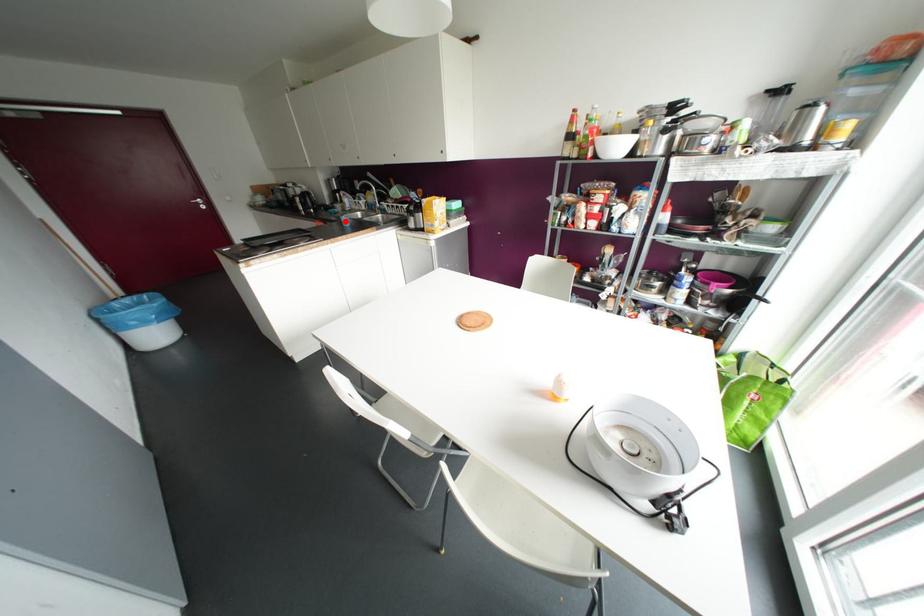
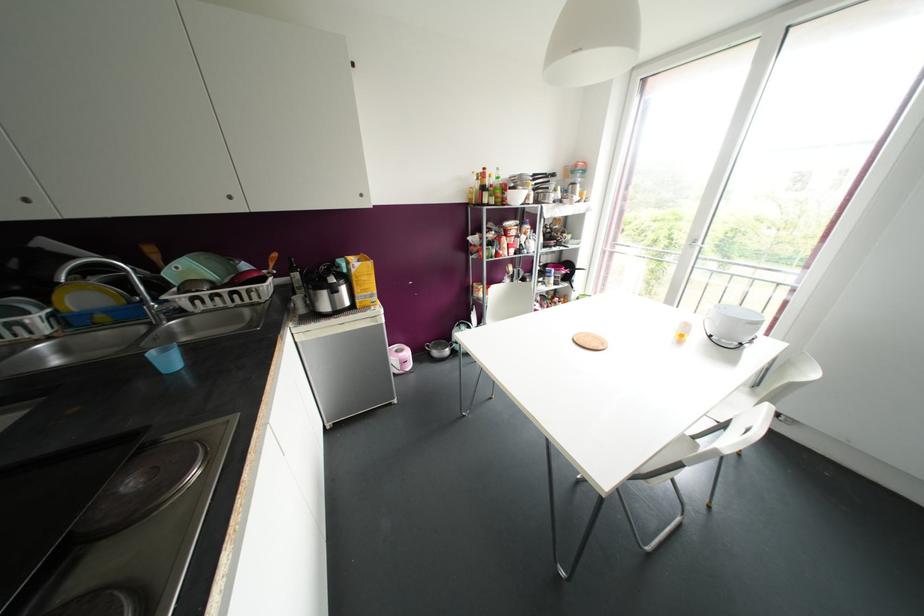
Where in the second image is the point corresponding to the highlighted location from the first image?

(168, 361)